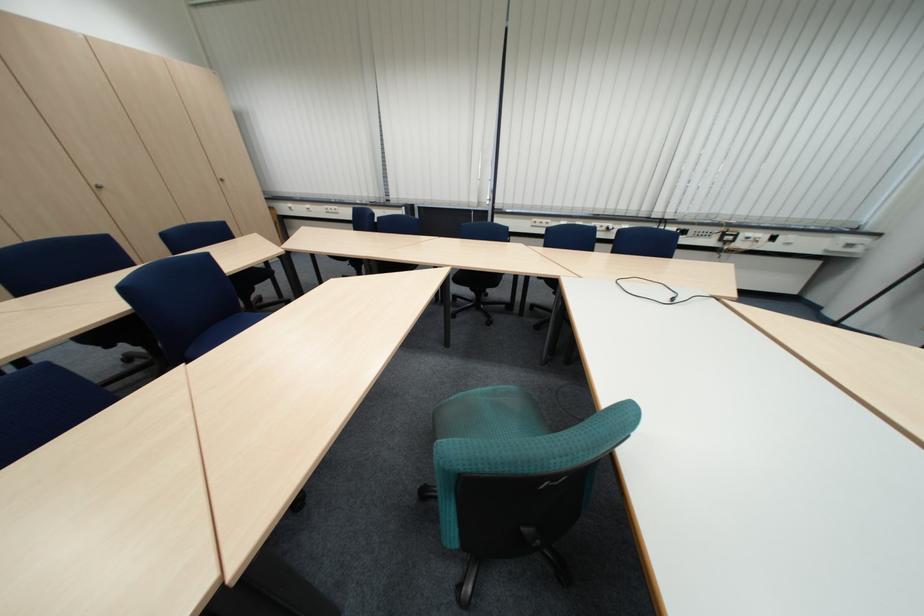
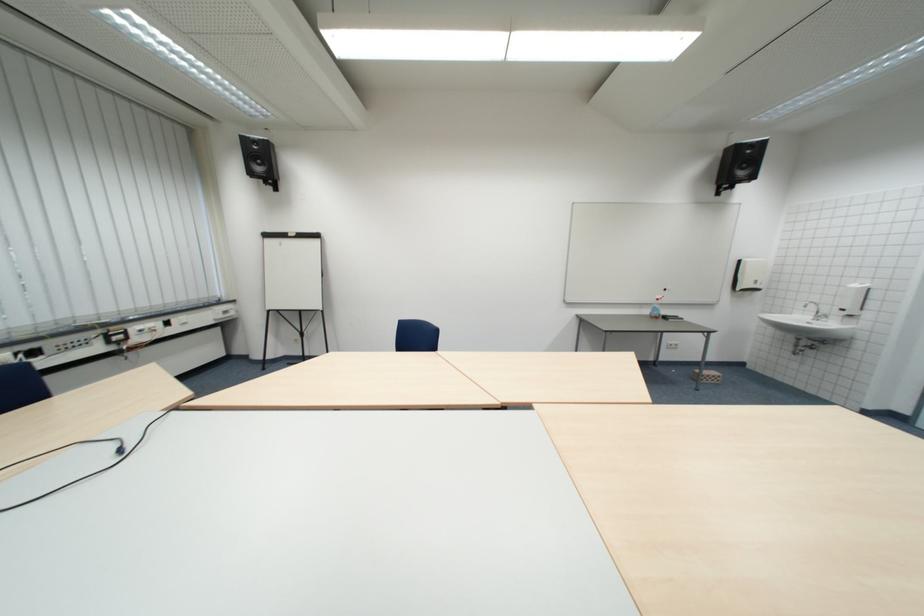
The images are taken continuously from a first-person perspective. In which direction is your viewpoint rotating?

The camera's rotation is toward right-down.